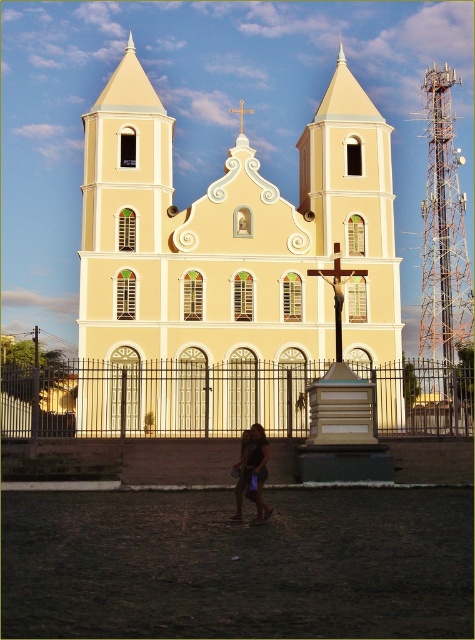
Question: Estimate the real-world distances between objects in this image. Which object is farther from the orange metallic tower at right?

Choices:
 (A) yellow matte church at center
 (B) gold metallic cross at center

Answer: (B)

Question: Which of the following is the farthest from the observer?

Choices:
 (A) (429, 124)
 (B) (84, 403)
 (C) (241, 490)

Answer: (A)

Question: Is dark brown leather bag at lower center below gold metallic cross at center?

Choices:
 (A) no
 (B) yes

Answer: (B)

Question: Observing the image, what is the correct spatial positioning of yellow matte church at center in reference to orange metallic tower at right?

Choices:
 (A) above
 (B) below

Answer: (A)

Question: Estimate the real-world distances between objects in this image. Which object is farther from the yellow matte church at center?

Choices:
 (A) gold metallic cross at center
 (B) orange metallic tower at right

Answer: (A)

Question: Is the position of dark brown leather bag at lower center more distant than that of gold metallic cross at center?

Choices:
 (A) yes
 (B) no

Answer: (B)